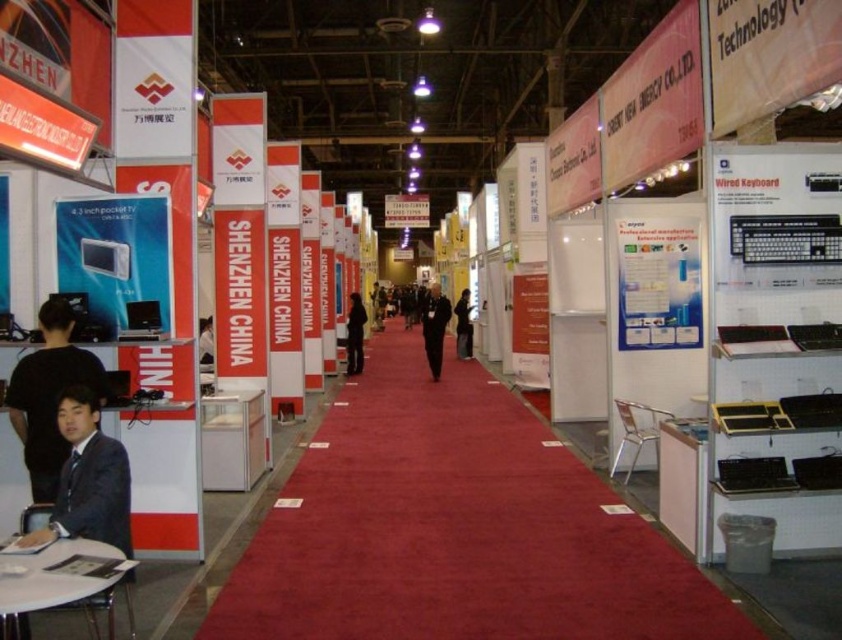
Which is below, black matte suit at center or black fabric coat at center?

black fabric coat at center is below.

Where is `black matte suit at center`? This screenshot has height=640, width=842. black matte suit at center is located at coordinates (434, 326).

Looking at this image, can you confirm if black matte suit at center is wider than dark fabric jacket at center?

Correct, the width of black matte suit at center exceeds that of dark fabric jacket at center.

Is black matte suit at center to the right of dark fabric jacket at center from the viewer's perspective?

Yes, black matte suit at center is to the right of dark fabric jacket at center.

Measure the distance between point (441, 304) and camera.

The distance of point (441, 304) from camera is 16.27 meters.

I want to click on black matte suit at center, so click(434, 326).

Based on the photo, is dark fabric jacket at center to the left of black fabric coat at center from the viewer's perspective?

Yes, dark fabric jacket at center is to the left of black fabric coat at center.

Who is higher up, dark fabric jacket at center or black fabric coat at center?

black fabric coat at center

Describe the element at coordinates (355, 333) in the screenshot. The height and width of the screenshot is (640, 842). I see `dark fabric jacket at center` at that location.

I want to click on dark fabric jacket at center, so click(x=355, y=333).